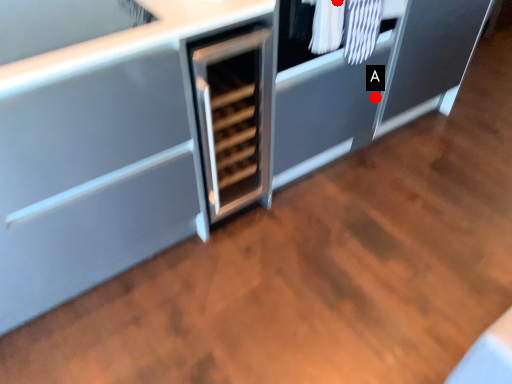
Question: Two points are circled on the image, labeled by A and B beside each circle. Which of the following is the farthest from the observer?

Choices:
 (A) A is further
 (B) B is further

Answer: (A)